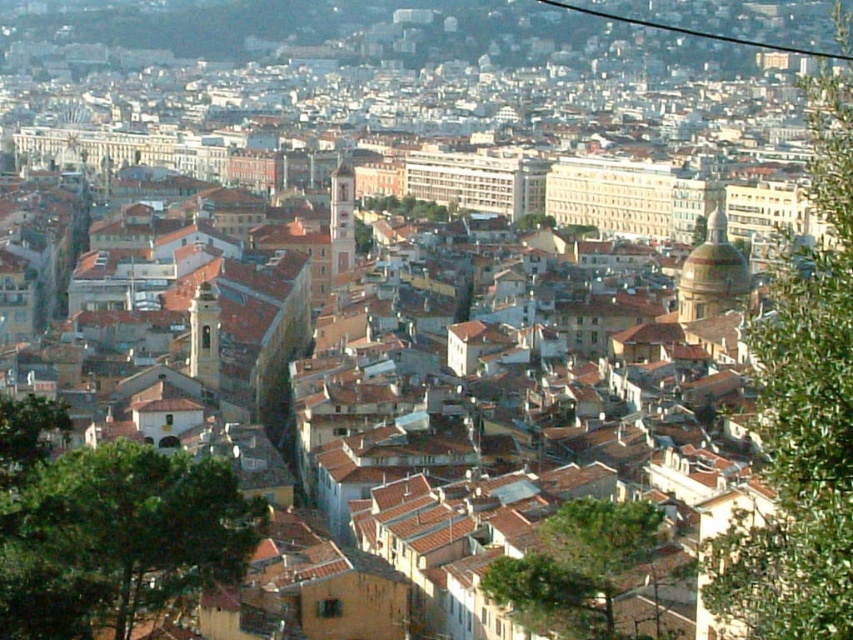
You are a city planner assessing the urban green spaces. You notice two green leafy trees in the scene. Which of the two trees, the green leafy tree at right or the green leafy tree at center, is taller?

The green leafy tree at right is taller than the green leafy tree at center.